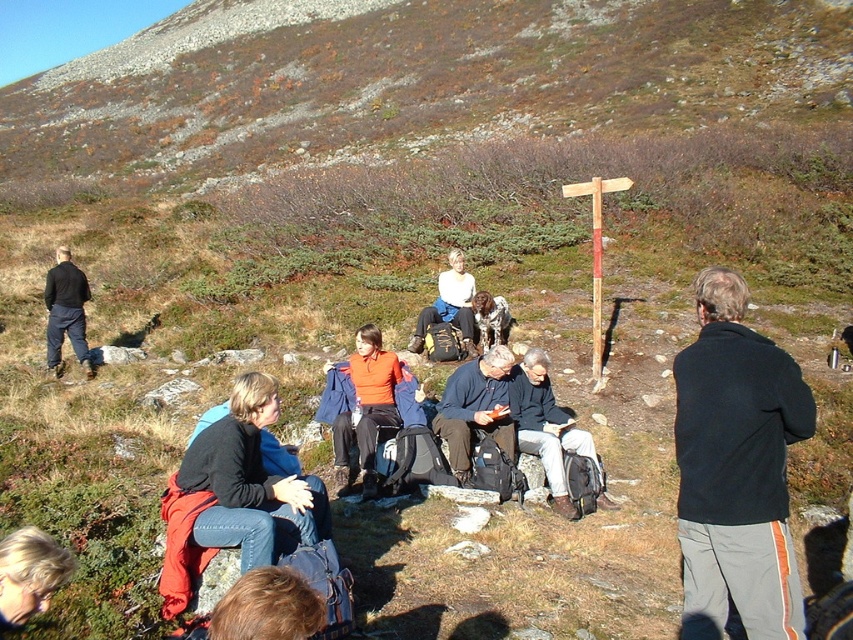
Question: Can you confirm if black fleece jacket at right is thinner than blonde hair at lower left?

Choices:
 (A) yes
 (B) no

Answer: (B)

Question: Which point is closer to the camera?

Choices:
 (A) blonde hair at lower center
 (B) dark blue jeans at left
 (C) blue fabric jacket at center
 (D) matte white sweater at center

Answer: (A)

Question: Is blue fabric jacket at center smaller than dark blue jeans at left?

Choices:
 (A) yes
 (B) no

Answer: (A)

Question: Among these points, which one is farthest from the camera?

Choices:
 (A) (370, 426)
 (B) (306, 584)
 (C) (776, 403)
 (D) (502, 349)

Answer: (D)

Question: Is dark blue jeans at center wider than blonde hair at lower center?

Choices:
 (A) no
 (B) yes

Answer: (B)

Question: Which of these objects is positioned farthest from the matte white sweater at center?

Choices:
 (A) dark blue jeans at center
 (B) blonde hair at lower center
 (C) dark blue jeans at left

Answer: (B)